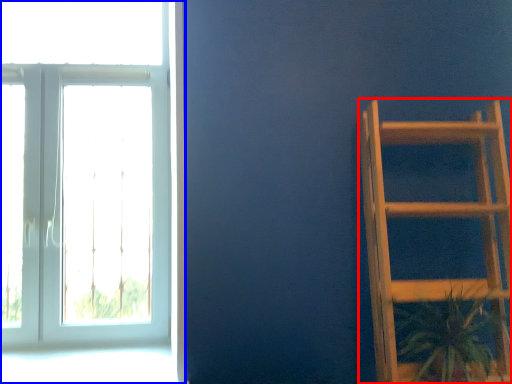
Question: Which object appears farthest to the camera in this image, furniture (highlighted by a red box) or window (highlighted by a blue box)?

Choices:
 (A) furniture
 (B) window

Answer: (B)